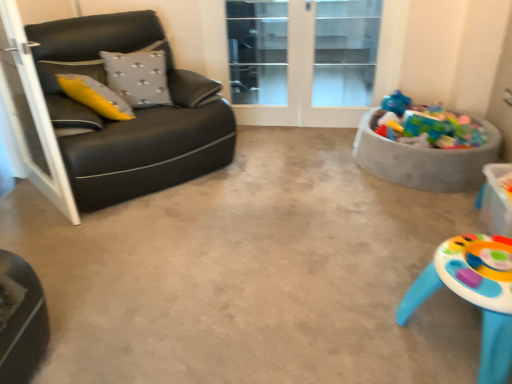
At what (x,y) coordinates should I click in order to perform the action: click on vacant space that is in between transparent glass screen door at upper center, the second screen door when ordered from front to back, and matte plastic table at lower right. Please return your answer as a coordinate pair (x, y). Looking at the image, I should click on (330, 201).